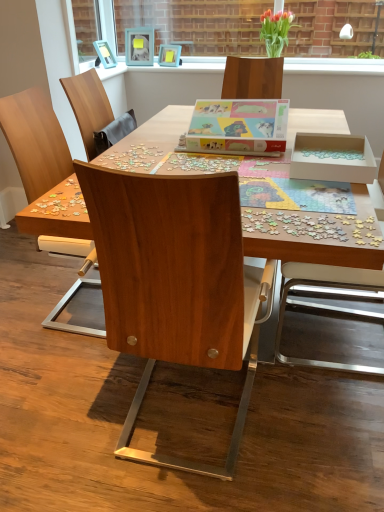
Question: Considering the relative sizes of wooden chair at center, marked as the 1th chair in a left-to-right arrangement, and teal matte picture frame at upper center, which is the 2th picture frame from right to left, in the image provided, is wooden chair at center, marked as the 1th chair in a left-to-right arrangement, shorter than teal matte picture frame at upper center, which is the 2th picture frame from right to left,?

Choices:
 (A) no
 (B) yes

Answer: (A)

Question: Is wooden chair at center, marked as the 1th chair in a left-to-right arrangement, next to teal matte picture frame at upper center, the 1th picture frame viewed from the left, and touching it?

Choices:
 (A) yes
 (B) no

Answer: (B)

Question: Does wooden chair at center, marked as the 1th chair in a left-to-right arrangement, appear on the right side of teal matte picture frame at upper center, which is the 2th picture frame from right to left?

Choices:
 (A) yes
 (B) no

Answer: (B)

Question: Considering the relative sizes of wooden chair at center, placed as the third chair when sorted from right to left, and teal matte picture frame at upper center, which is the 2th picture frame from right to left, in the image provided, is wooden chair at center, placed as the third chair when sorted from right to left, thinner than teal matte picture frame at upper center, which is the 2th picture frame from right to left,?

Choices:
 (A) no
 (B) yes

Answer: (A)

Question: Does wooden chair at center, placed as the third chair when sorted from right to left, have a smaller size compared to teal matte picture frame at upper center, which is the 2th picture frame from right to left?

Choices:
 (A) yes
 (B) no

Answer: (B)

Question: From a real-world perspective, is teal matte picture frame at upper center, which is the 2th picture frame from right to left, positioned above or below wooden chair at center, which is the third chair from left to right?

Choices:
 (A) above
 (B) below

Answer: (A)

Question: Choose the correct answer: Is teal matte picture frame at upper center, which is the 2th picture frame from right to left, inside wooden chair at center, which is the third chair from left to right, or outside it?

Choices:
 (A) outside
 (B) inside

Answer: (A)

Question: Is teal matte picture frame at upper center, the 1th picture frame viewed from the left, taller or shorter than wooden chair at center, which is the third chair from left to right?

Choices:
 (A) tall
 (B) short

Answer: (B)

Question: Relative to wooden chair at center, the first chair from the right, is teal matte picture frame at upper center, the 1th picture frame viewed from the left, in front or behind?

Choices:
 (A) front
 (B) behind

Answer: (B)

Question: Does point (259, 49) appear closer or farther from the camera than point (286, 42)?

Choices:
 (A) farther
 (B) closer

Answer: (A)

Question: From their relative heights in the image, would you say clear glass vase at upper center is taller or shorter than matte glass vase at upper center?

Choices:
 (A) short
 (B) tall

Answer: (B)

Question: From the image's perspective, is clear glass vase at upper center above or below matte glass vase at upper center?

Choices:
 (A) below
 (B) above

Answer: (B)

Question: Looking at the image, does clear glass vase at upper center seem bigger or smaller compared to matte glass vase at upper center?

Choices:
 (A) big
 (B) small

Answer: (A)

Question: From a real-world perspective, is pastel matte puzzle box at center positioned above or below wooden desk at center?

Choices:
 (A) above
 (B) below

Answer: (A)

Question: Would you say pastel matte puzzle box at center is inside or outside wooden desk at center?

Choices:
 (A) outside
 (B) inside

Answer: (A)